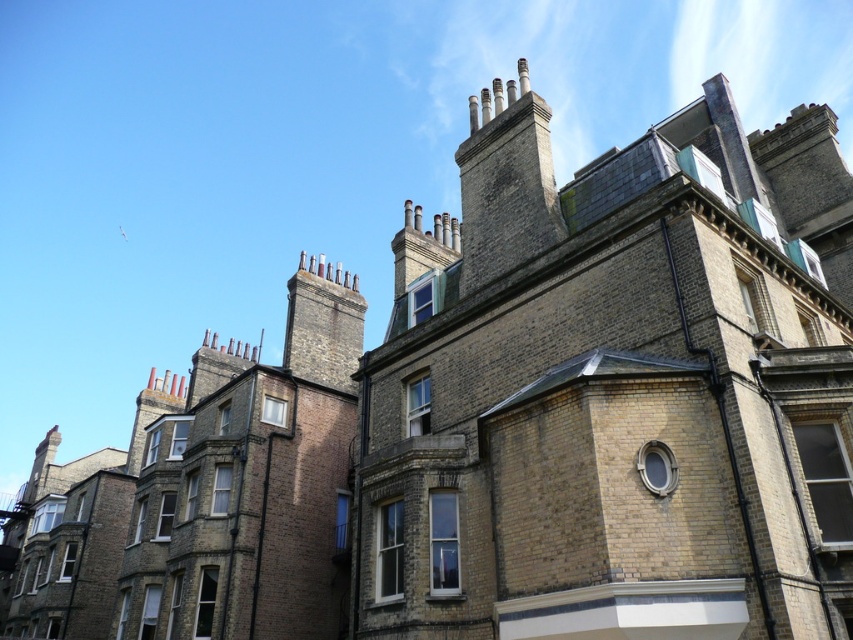
From the picture: You are standing in front of the row of traditional brick buildings. There is a brown brick chimney at upper center marked by point [506,186]. If you look directly upward from that point, will you see the top of the chimney or the sky?

The point [506,186] marks the brown brick chimney at upper center. Since the chimney is a structure on the roof, looking directly upward from that point would mean looking at the chimney itself, so you would see the top of the chimney, not the sky.

In the scene shown: You are standing on the street looking at the row of buildings. Which chimney, the brown brick chimney at upper center or the brown stone chimney at upper center, appears closer to you?

The brown brick chimney at upper center appears closer to the viewer than the brown stone chimney at upper center.